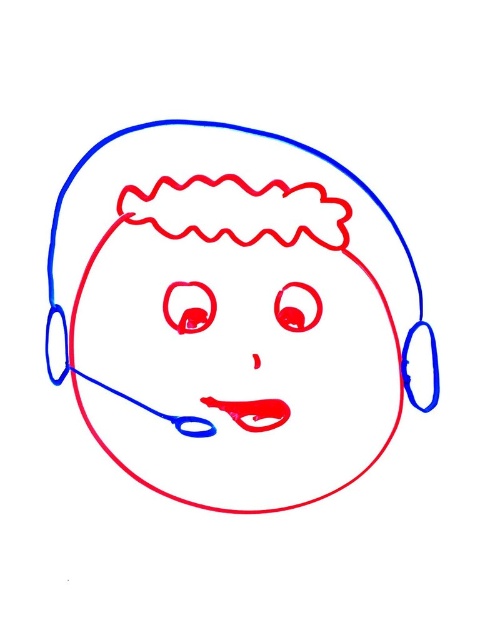
You are an artist looking at the drawing of the head and headset. You notice two points marked at coordinates point (x=394, y=337) and point (x=226, y=408). Which point is closer to the viewer?

Point (x=394, y=337) is in front of point (x=226, y=408), so it is closer to the viewer.

You are an artist trying to draw the headset in the correct position. According to the image, where exactly is the matte blue headset at center located?

The matte blue headset at center is located at point (212, 241).